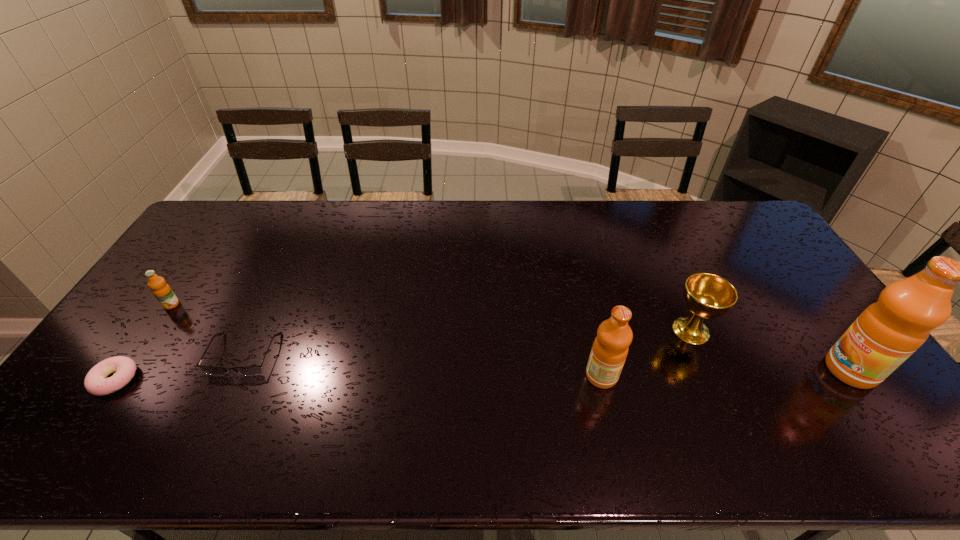
At what (x,y) coordinates should I click in order to perform the action: click on vacant space that is in between the fourth object from right to left and the second tallest object. Please return your answer as a coordinate pair (x, y). The image size is (960, 540). Looking at the image, I should click on (422, 365).

Locate an element on the screen. The height and width of the screenshot is (540, 960). unoccupied position between the right fruit juice and the fourth shortest object is located at coordinates (771, 350).

The height and width of the screenshot is (540, 960). Identify the location of free point between the fourth object from right to left and the third tallest object. (468, 342).

Locate an element on the screen. Image resolution: width=960 pixels, height=540 pixels. vacant space that is in between the tallest object and the fifth object from left to right is located at coordinates (771, 350).

Identify the location of free space that is in between the shorter fruit juice and the doughnut. (358, 377).

Find the location of a particular element. This screenshot has height=540, width=960. free space between the chalice and the tallest object is located at coordinates (771, 350).

The width and height of the screenshot is (960, 540). What are the coordinates of `unoccupied area between the fifth object from left to right and the doughnut` in the screenshot? It's located at (403, 355).

Identify which object is the fourth nearest to the third object from left to right. Please provide its 2D coordinates. Your answer should be formatted as a tuple, i.e. [(x, y)], where the tuple contains the x and y coordinates of a point satisfying the conditions above.

[(706, 295)]

Select which object appears as the closest to the right fruit juice. Please provide its 2D coordinates. Your answer should be formatted as a tuple, i.e. [(x, y)], where the tuple contains the x and y coordinates of a point satisfying the conditions above.

[(706, 295)]

The height and width of the screenshot is (540, 960). What are the coordinates of `free space that satisfies the following two spatial constraints: 1. on the label of the chalice; 2. on the left side of the orange juice` in the screenshot? It's located at (154, 330).